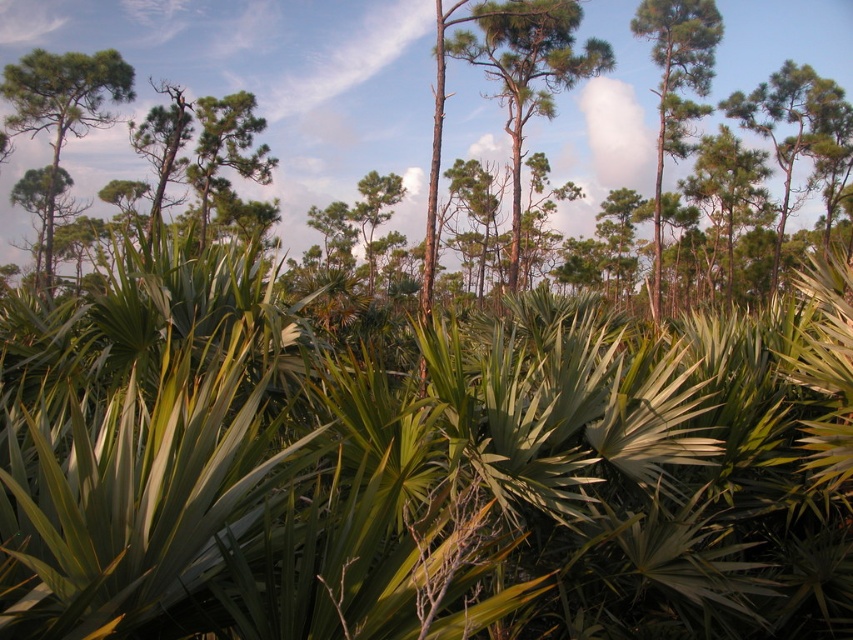
Question: Does green textured pine tree at center lie in front of green matte tree at upper right?

Choices:
 (A) yes
 (B) no

Answer: (A)

Question: Can you confirm if green matte tree at upper left is thinner than green matte tree at upper right?

Choices:
 (A) yes
 (B) no

Answer: (B)

Question: Which of the following is the closest to the observer?

Choices:
 (A) (28, 106)
 (B) (511, 237)

Answer: (A)

Question: Which point is farther to the camera?

Choices:
 (A) (512, 152)
 (B) (693, 19)
 (C) (94, 65)

Answer: (A)

Question: Is green textured pine tree at center behind green matte tree at upper left?

Choices:
 (A) yes
 (B) no

Answer: (B)

Question: Which object is the farthest from the green matte tree at upper right?

Choices:
 (A) green textured pine tree at center
 (B) green matte tree at upper left

Answer: (B)